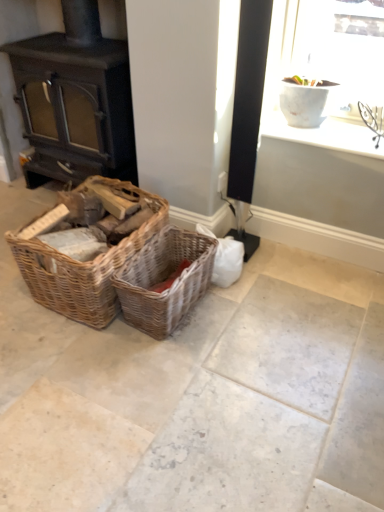
Question: From a real-world perspective, is woven wood basket at left, the 1th picnic basket when ordered from left to right, physically above woven brown picnic basket at center, the 1th picnic basket positioned from the right?

Choices:
 (A) yes
 (B) no

Answer: (A)

Question: Is woven wood basket at left, the 1th picnic basket when ordered from left to right, positioned in front of woven brown picnic basket at center, the 1th picnic basket positioned from the right?

Choices:
 (A) yes
 (B) no

Answer: (A)

Question: Is woven wood basket at left, the second picnic basket in the right-to-left sequence, not within woven brown picnic basket at center, placed as the second picnic basket when sorted from left to right?

Choices:
 (A) no
 (B) yes

Answer: (B)

Question: Is woven wood basket at left, the 1th picnic basket when ordered from left to right, taller than woven brown picnic basket at center, placed as the second picnic basket when sorted from left to right?

Choices:
 (A) yes
 (B) no

Answer: (A)

Question: Is woven wood basket at left, the 1th picnic basket when ordered from left to right, to the right of woven brown picnic basket at center, placed as the second picnic basket when sorted from left to right, from the viewer's perspective?

Choices:
 (A) no
 (B) yes

Answer: (A)

Question: From a real-world perspective, is woven wood basket at left, the 1th picnic basket when ordered from left to right, located beneath woven brown picnic basket at center, placed as the second picnic basket when sorted from left to right?

Choices:
 (A) no
 (B) yes

Answer: (A)

Question: Considering the relative sizes of white ceramic vase at upper right and matte black wood burning stove at left in the image provided, is white ceramic vase at upper right thinner than matte black wood burning stove at left?

Choices:
 (A) no
 (B) yes

Answer: (B)

Question: Is white ceramic vase at upper right bigger than matte black wood burning stove at left?

Choices:
 (A) yes
 (B) no

Answer: (B)

Question: Is white ceramic vase at upper right at the right side of matte black wood burning stove at left?

Choices:
 (A) no
 (B) yes

Answer: (B)

Question: From the image's perspective, is white ceramic vase at upper right below matte black wood burning stove at left?

Choices:
 (A) yes
 (B) no

Answer: (A)

Question: Can you confirm if white ceramic vase at upper right is wider than matte black wood burning stove at left?

Choices:
 (A) yes
 (B) no

Answer: (B)

Question: Does white ceramic vase at upper right appear on the left side of matte black wood burning stove at left?

Choices:
 (A) yes
 (B) no

Answer: (B)

Question: Are matte black wood burning stove at left and white ceramic vase at upper right beside each other?

Choices:
 (A) no
 (B) yes

Answer: (A)